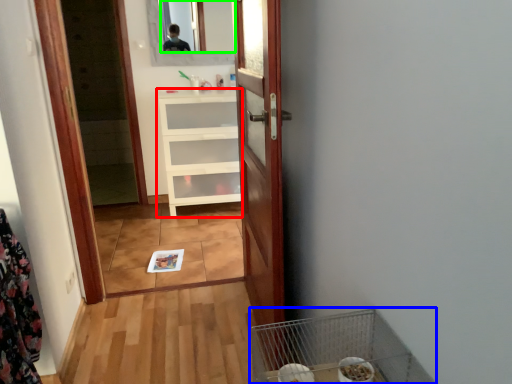
Question: Which is farther away from cabinetry (highlighted by a red box)? bird cage (highlighted by a blue box) or mirror (highlighted by a green box)?

Choices:
 (A) bird cage
 (B) mirror

Answer: (A)